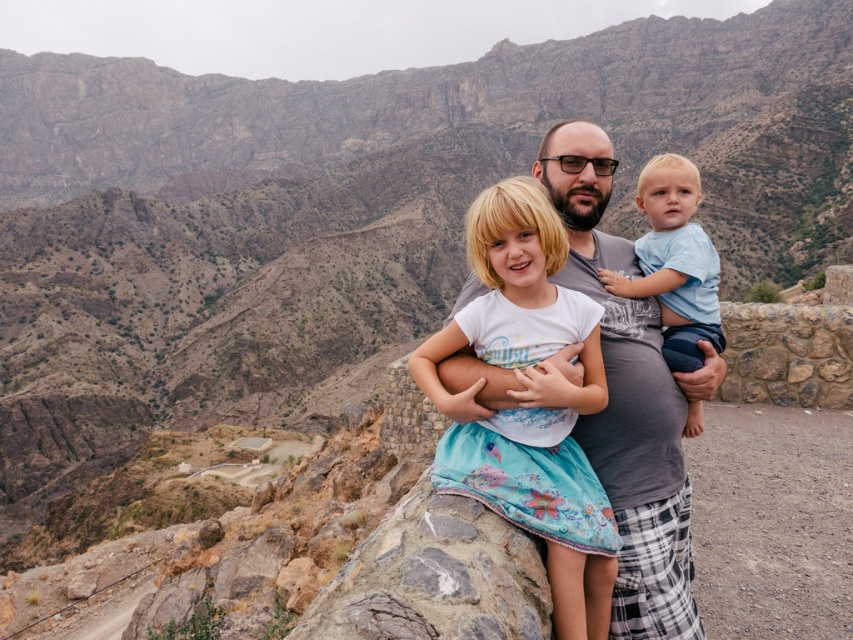
You are a photographer taking a family portrait. You have two outfits to choose from for the main subject. The options are the white cotton dress at center and the light blue cotton shirt at center. Which outfit would you recommend if you want the clothing to stand out more against the rugged, arid mountain backdrop?

The white cotton dress at center is bigger than the light blue cotton shirt at center, so the white cotton dress at center would stand out more against the rugged, arid mountain backdrop due to its larger size.

You are a photographer trying to capture a group photo of the family. You notice the white cotton dress at center and the light blue cotton shirt at center. Which clothing item should you adjust to ensure both are fully visible in the frame?

The white cotton dress at center is to the left of light blue cotton shirt at center, so you should adjust the white cotton dress at center to move it slightly to the right to avoid overlapping with the light blue cotton shirt at center and ensure both are fully visible in the frame.